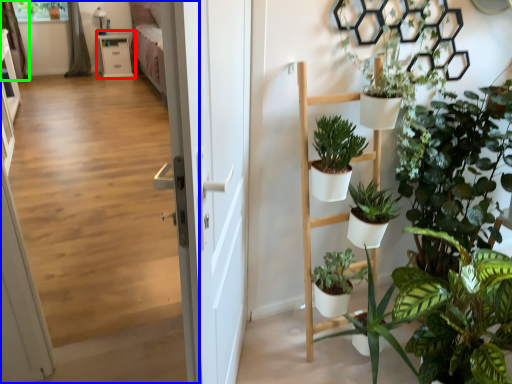
Question: Considering the real-world distances, which object is farthest from table (highlighted by a red box)? corridor (highlighted by a blue box) or curtain (highlighted by a green box)?

Choices:
 (A) corridor
 (B) curtain

Answer: (A)